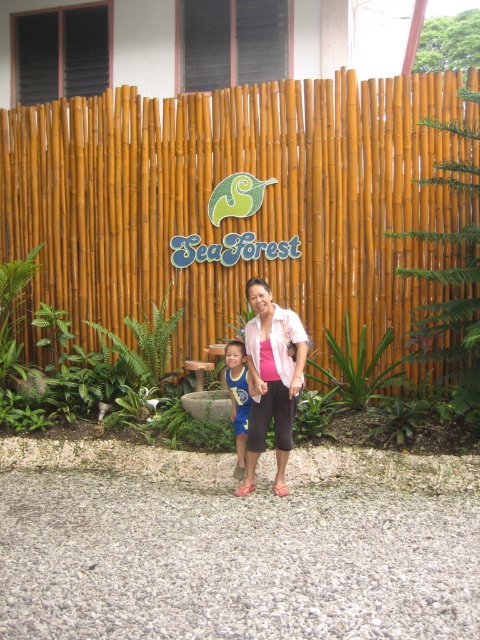
You are a photographer trying to capture a clear shot of both the pink matte shirt at center and the blue jersey at center. Since you want both subjects to be visible, which one should you focus on to ensure the other remains in the background?

You should focus on the pink matte shirt at center because it is in front of the blue jersey at center, so if you focus on the front subject, the background subject will still be visible.

Looking at this image, you are a photographer trying to capture both the bamboo fence at center and the blue jersey at center in a single frame. Based on their widths, which object would require you to adjust your camera angle more to ensure both are fully visible?

The bamboo fence at center might be wider than blue jersey at center, so you would need to adjust your camera angle more to fully capture the bamboo fence at center in the frame.